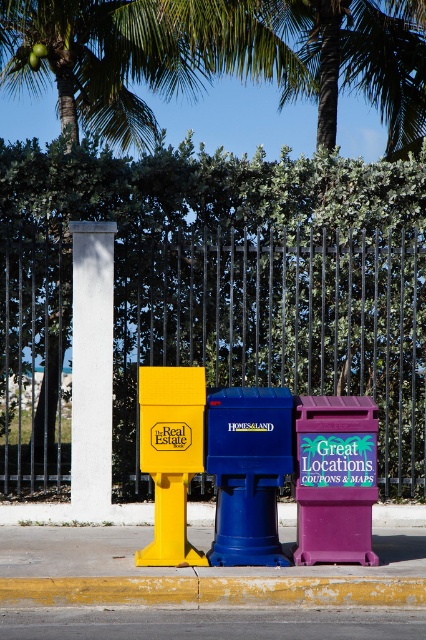
Question: From the image, what is the correct spatial relationship of blue plastic recycling bin at center in relation to matte yellow real estate box at center?

Choices:
 (A) below
 (B) above

Answer: (A)

Question: Can you confirm if white concrete pillar at center is bigger than purple matte recycling bin at center?

Choices:
 (A) no
 (B) yes

Answer: (B)

Question: Can you confirm if white concrete pillar at center is positioned to the left of purple matte recycling bin at center?

Choices:
 (A) no
 (B) yes

Answer: (B)

Question: Based on their relative distances, which object is nearer to the purple matte recycling bin at center?

Choices:
 (A) white concrete pillar at center
 (B) yellow painted concrete curb at lower center
 (C) matte yellow real estate box at center

Answer: (B)

Question: Which object is the closest to the black metal fence at center?

Choices:
 (A) white concrete pillar at center
 (B) matte yellow real estate box at center

Answer: (A)

Question: Which object is farther from the camera taking this photo?

Choices:
 (A) white concrete pillar at center
 (B) gray asphalt at lower center

Answer: (A)